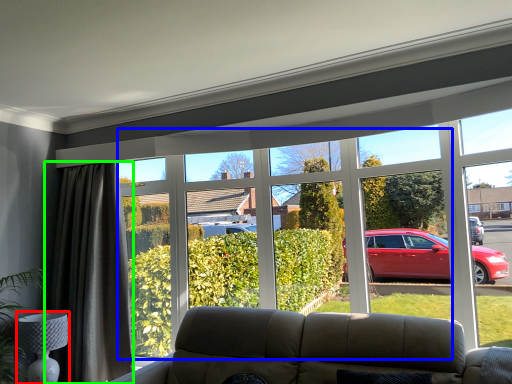
Question: Based on their relative distances, which object is nearer to lamp (highlighted by a red box)? Choose from bay window (highlighted by a blue box) and curtain (highlighted by a green box).

Choices:
 (A) bay window
 (B) curtain

Answer: (B)